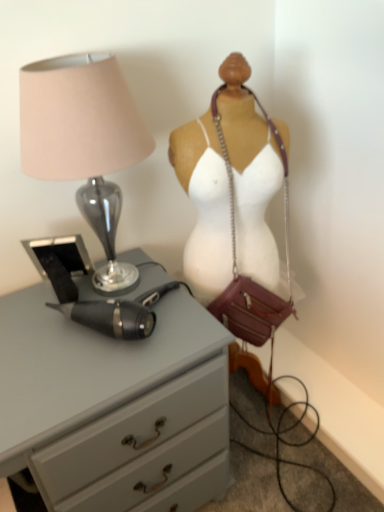
Question: Could you tell me if matte glass lamp at left is facing matte gray chest of drawers at left?

Choices:
 (A) yes
 (B) no

Answer: (B)

Question: Is matte glass lamp at left taller than matte gray chest of drawers at left?

Choices:
 (A) no
 (B) yes

Answer: (A)

Question: Is the depth of matte glass lamp at left greater than that of matte gray chest of drawers at left?

Choices:
 (A) yes
 (B) no

Answer: (A)

Question: Is matte glass lamp at left shorter than matte gray chest of drawers at left?

Choices:
 (A) no
 (B) yes

Answer: (B)

Question: Does matte glass lamp at left touch matte gray chest of drawers at left?

Choices:
 (A) no
 (B) yes

Answer: (A)

Question: Which is correct: matte glass lamp at left is inside leather/chain strap at center, or outside of it?

Choices:
 (A) outside
 (B) inside

Answer: (A)

Question: Is matte glass lamp at left taller or shorter than leather/chain strap at center?

Choices:
 (A) short
 (B) tall

Answer: (A)

Question: Looking at their shapes, would you say matte glass lamp at left is wider or thinner than leather/chain strap at center?

Choices:
 (A) wide
 (B) thin

Answer: (A)

Question: From a real-world perspective, is matte glass lamp at left above or below leather/chain strap at center?

Choices:
 (A) below
 (B) above

Answer: (B)

Question: Considering the positions of matte gray chest of drawers at left and leather/chain strap at center in the image, is matte gray chest of drawers at left bigger or smaller than leather/chain strap at center?

Choices:
 (A) big
 (B) small

Answer: (A)

Question: From the image's perspective, is matte gray chest of drawers at left above or below leather/chain strap at center?

Choices:
 (A) above
 (B) below

Answer: (B)

Question: Does point (51, 309) appear closer or farther from the camera than point (198, 242)?

Choices:
 (A) closer
 (B) farther

Answer: (A)

Question: Visually, is matte gray chest of drawers at left positioned to the left or to the right of leather/chain strap at center?

Choices:
 (A) left
 (B) right

Answer: (A)

Question: Is leather/chain strap at center inside the boundaries of matte glass lamp at left, or outside?

Choices:
 (A) inside
 (B) outside

Answer: (B)

Question: Is leather/chain strap at center in front of or behind matte glass lamp at left in the image?

Choices:
 (A) front
 (B) behind

Answer: (B)